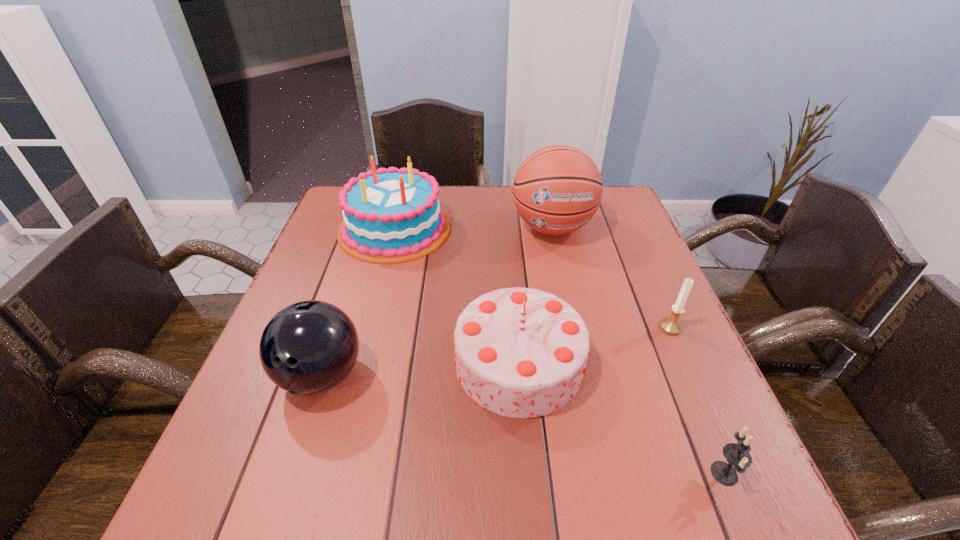
I want to click on the tallest object, so click(557, 190).

This screenshot has width=960, height=540. I want to click on the left birthday cake, so click(391, 215).

Where is `the right birthday cake`? the right birthday cake is located at coordinates (520, 352).

This screenshot has width=960, height=540. What are the coordinates of `bowling ball` in the screenshot? It's located at (309, 347).

In order to click on the fifth tallest object in this screenshot , I will do `click(671, 325)`.

At what (x,y) coordinates should I click in order to perform the action: click on the taller candle holder. Please return your answer as a coordinate pair (x, y). The image size is (960, 540). Looking at the image, I should click on (671, 325).

This screenshot has height=540, width=960. Find the location of `the nearest object`. the nearest object is located at coordinates (737, 455).

Identify the location of the nearer candle holder. The image size is (960, 540). (737, 455).

Identify the location of free space located 0.340m on the logo side of the basketball. This screenshot has height=540, width=960. (580, 354).

Locate an element on the screen. vacant space located on the front of the farther birthday cake is located at coordinates (376, 302).